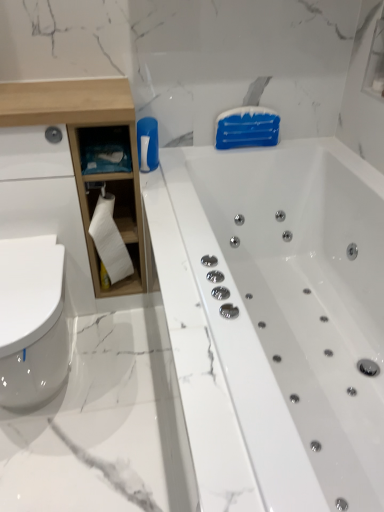
Question: Looking at their shapes, would you say white wood cabinet at left is wider or thinner than white glossy bathtub at center?

Choices:
 (A) thin
 (B) wide

Answer: (A)

Question: From a real-world perspective, is white wood cabinet at left above or below white glossy bathtub at center?

Choices:
 (A) above
 (B) below

Answer: (A)

Question: Based on their relative distances, which object is farther from the white wood cabinet at left?

Choices:
 (A) white matte toilet paper at left
 (B) white glossy bathtub at center
 (C) white glossy toilet at lower left

Answer: (B)

Question: Which object is the farthest from the white glossy bathtub at center?

Choices:
 (A) white wood cabinet at left
 (B) white glossy toilet at lower left
 (C) white matte toilet paper at left

Answer: (B)